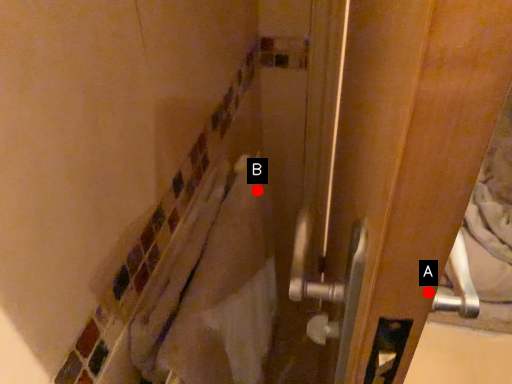
Question: Two points are circled on the image, labeled by A and B beside each circle. Which point is farther to the camera?

Choices:
 (A) A is further
 (B) B is further

Answer: (B)